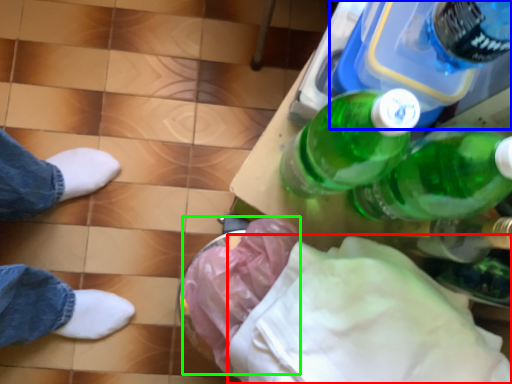
Question: Based on their relative distances, which object is nearer to cloth (highlighted by a red box)? Choose from bottle (highlighted by a blue box) and material (highlighted by a green box).

Choices:
 (A) bottle
 (B) material

Answer: (B)